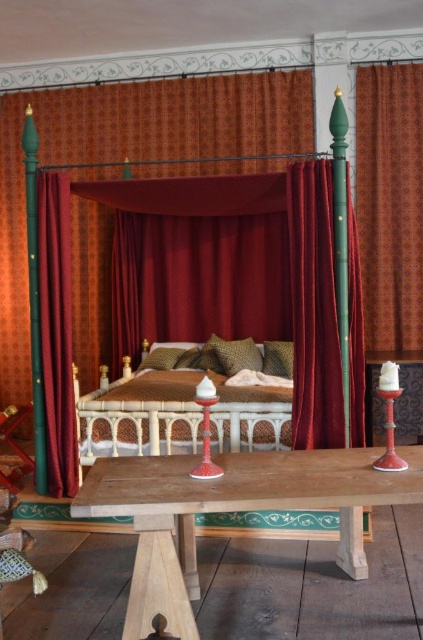
Question: Is velvet curtain at right further to the viewer compared to wooden carved bed at center?

Choices:
 (A) no
 (B) yes

Answer: (A)

Question: Is wooden table at lower center to the right of velvet green pillow at center from the viewer's perspective?

Choices:
 (A) yes
 (B) no

Answer: (A)

Question: Can you confirm if wooden table at lower center is smaller than wooden carved bed at center?

Choices:
 (A) no
 (B) yes

Answer: (B)

Question: Estimate the real-world distances between objects in this image. Which object is closer to the leopard print pillow at center?

Choices:
 (A) wooden table at lower center
 (B) velvet curtain at left

Answer: (B)

Question: Which of the following is the closest to the observer?

Choices:
 (A) velvet curtain at left
 (B) velvet green pillow at center
 (C) wooden carved bed at center

Answer: (C)

Question: Which point is farther from the camera taking this photo?

Choices:
 (A) (244, 368)
 (B) (320, 273)
 (C) (36, 195)

Answer: (A)